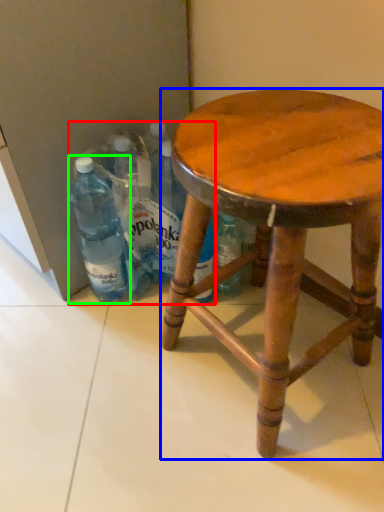
Question: Which object is positioned closest to beverage (highlighted by a red box)? Select from stool (highlighted by a blue box) and bottle (highlighted by a green box).

Choices:
 (A) stool
 (B) bottle

Answer: (B)